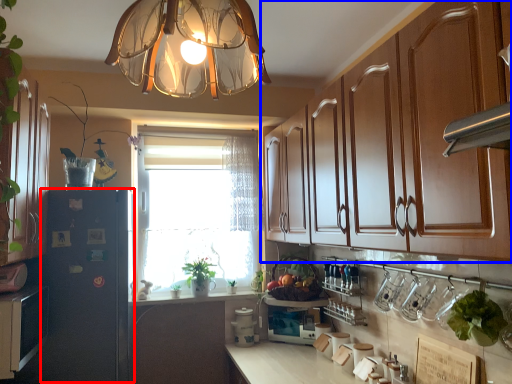
Question: Which of the following is the farthest to the observer, fridge (highlighted by a red box) or cabinetry (highlighted by a blue box)?

Choices:
 (A) fridge
 (B) cabinetry

Answer: (A)